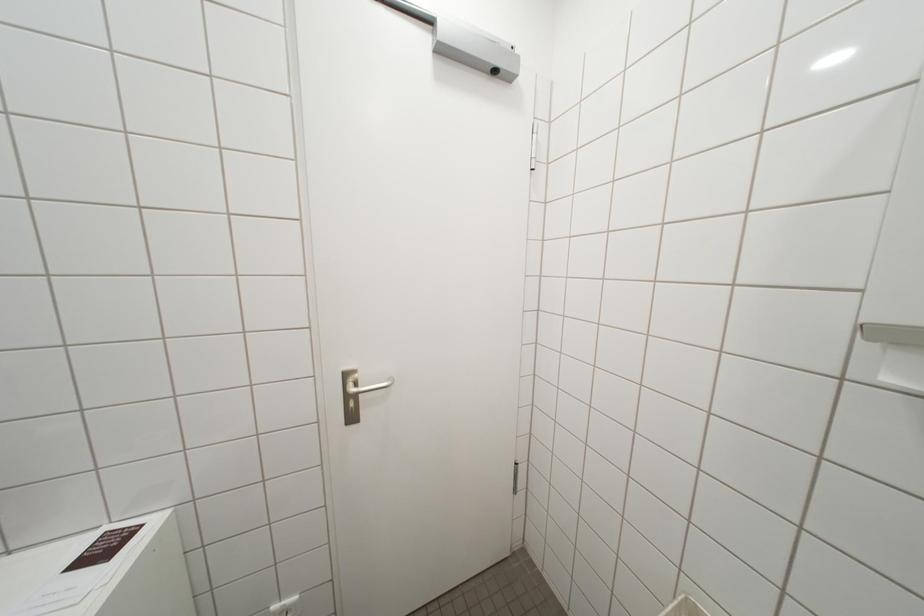
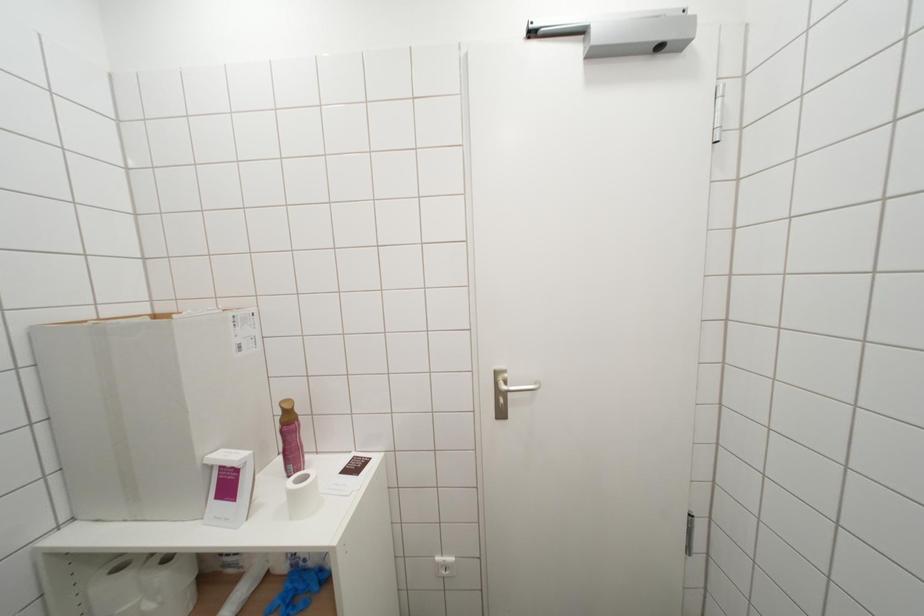
Which direction would the cameraman need to move to produce the second image?

The cameraman walked toward left, backward.